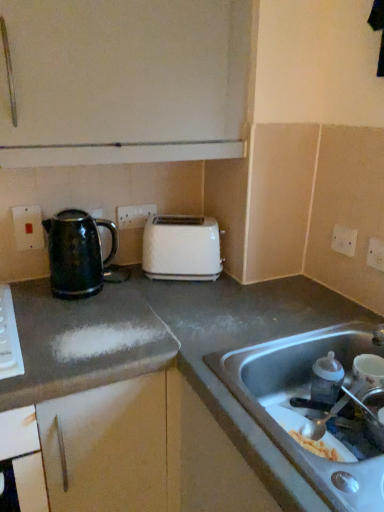
Measure the distance between white plastic electric outlet at upper right, which appears as the 3th electric outlet when viewed from the left, and camera.

The depth of white plastic electric outlet at upper right, which appears as the 3th electric outlet when viewed from the left, is 4.10 feet.

How much space does white plastic electric outlet at upper right, marked as the 2th electric outlet in a right-to-left arrangement, occupy horizontally?

white plastic electric outlet at upper right, marked as the 2th electric outlet in a right-to-left arrangement, is 0.70 inches wide.

Identify the location of white plastic electric outlet at center, marked as the first electric outlet in a back-to-front arrangement. (134, 215).

Image resolution: width=384 pixels, height=512 pixels. What do you see at coordinates (28, 228) in the screenshot?
I see `matte plastic electric outlet at upper left, placed as the 4th electric outlet when sorted from right to left` at bounding box center [28, 228].

What do you see at coordinates (376, 254) in the screenshot? This screenshot has height=512, width=384. I see `white plastic electric outlet at upper right, marked as the first electric outlet in a front-to-back arrangement` at bounding box center [376, 254].

Locate an element on the screen. The width and height of the screenshot is (384, 512). white plastic electric outlet at upper right, acting as the third electric outlet starting from the back is located at coordinates (344, 240).

Is metallic silver faucet at sink right placed right next to shiny metallic kettle at center-left, which is the second countertop in right-to-left order?

No, metallic silver faucet at sink right is not touching shiny metallic kettle at center-left, which is the second countertop in right-to-left order.

Locate an element on the screen. The height and width of the screenshot is (512, 384). countertop that is the 2nd object to the left of the metallic silver faucet at sink right, starting at the anchor is located at coordinates (83, 341).

Consider the image. Considering the relative positions of metallic silver faucet at sink right and shiny metallic kettle at center-left, which is the second countertop in right-to-left order, in the image provided, is metallic silver faucet at sink right to the right of shiny metallic kettle at center-left, which is the second countertop in right-to-left order, from the viewer's perspective?

Yes, metallic silver faucet at sink right is to the right of shiny metallic kettle at center-left, which is the second countertop in right-to-left order.

Is there a large distance between shiny metallic kettle at left and white plastic electric outlet at upper right, acting as the third electric outlet starting from the back?

They are positioned close to each other.

Consider the image. Does shiny metallic kettle at left have a lesser height compared to white plastic electric outlet at upper right, acting as the third electric outlet starting from the back?

In fact, shiny metallic kettle at left may be taller than white plastic electric outlet at upper right, acting as the third electric outlet starting from the back.

Between shiny metallic kettle at left and white plastic electric outlet at upper right, marked as the 2th electric outlet in a right-to-left arrangement, which one appears on the left side from the viewer's perspective?

shiny metallic kettle at left.

From the image's perspective, relative to white plastic toaster at center, is white plastic electric outlet at upper right, which is the second electric outlet in front-to-back order, above or below?

Clearly, from the image's perspective, white plastic electric outlet at upper right, which is the second electric outlet in front-to-back order, is above white plastic toaster at center.

Can you confirm if white plastic electric outlet at upper right, which is the second electric outlet in front-to-back order, is positioned to the right of white plastic toaster at center?

Yes.

What's the angular difference between white plastic electric outlet at upper right, acting as the third electric outlet starting from the back, and white plastic toaster at center's facing directions?

60.6 degrees.

Starting from the white plastic toaster at center, which electric outlet is the 2nd one in front? Please provide its 2D coordinates.

[(344, 240)]

How many degrees apart are the facing directions of white plastic toaster at center and stainless steel sink at lower right?

The angular difference between white plastic toaster at center and stainless steel sink at lower right is 61.6 degrees.

Is white plastic toaster at center oriented towards stainless steel sink at lower right?

No.

Is white plastic toaster at center in front of or behind stainless steel sink at lower right in the image?

Visually, white plastic toaster at center is located behind stainless steel sink at lower right.

Which of these two, white plastic toaster at center or stainless steel sink at lower right, is bigger?

stainless steel sink at lower right.

From the picture: Is shiny metallic kettle at left situated inside stainless steel sink at lower right or outside?

shiny metallic kettle at left is outside stainless steel sink at lower right.

Is shiny metallic kettle at left smaller than stainless steel sink at lower right?

Yes.

From a real-world perspective, between shiny metallic kettle at left and stainless steel sink at lower right, who is vertically lower?

stainless steel sink at lower right is physically lower.

Is white plastic electric outlet at center, placed as the second electric outlet when sorted from left to right, a part of shiny metallic kettle at center-left, which is the second countertop in right-to-left order?

Actually, white plastic electric outlet at center, placed as the second electric outlet when sorted from left to right, is outside shiny metallic kettle at center-left, which is the second countertop in right-to-left order.

Considering the relative sizes of shiny metallic kettle at center-left, which is the second countertop in right-to-left order, and white plastic electric outlet at center, the fourth electric outlet from the front, in the image provided, is shiny metallic kettle at center-left, which is the second countertop in right-to-left order, shorter than white plastic electric outlet at center, the fourth electric outlet from the front,?

No, shiny metallic kettle at center-left, which is the second countertop in right-to-left order, is not shorter than white plastic electric outlet at center, the fourth electric outlet from the front.

Is white plastic electric outlet at center, the fourth electric outlet from the front, at the back of shiny metallic kettle at center-left, which is the second countertop in right-to-left order?

No, white plastic electric outlet at center, the fourth electric outlet from the front, is not at the back of shiny metallic kettle at center-left, which is the second countertop in right-to-left order.

Which is more to the left, shiny metallic kettle at center-left, which is the second countertop in right-to-left order, or white plastic electric outlet at center, marked as the first electric outlet in a back-to-front arrangement?

Positioned to the left is shiny metallic kettle at center-left, which is the second countertop in right-to-left order.

Image resolution: width=384 pixels, height=512 pixels. In order to click on sink located below the matte plastic electric outlet at upper left, which is counted as the second electric outlet, starting from the back (from the image's perspective) in this screenshot , I will do `click(304, 396)`.

From the image's perspective, who appears lower, stainless steel sink at lower right or matte plastic electric outlet at upper left, which is counted as the first electric outlet, starting from the left?

stainless steel sink at lower right appears lower in the image.

Does stainless steel sink at lower right contain matte plastic electric outlet at upper left, placed as the 4th electric outlet when sorted from right to left?

That's incorrect, matte plastic electric outlet at upper left, placed as the 4th electric outlet when sorted from right to left, is not inside stainless steel sink at lower right.

From a real-world perspective, count 1st countertops downward from the metallic silver faucet at sink right and point to it. Please provide its 2D coordinates.

[(83, 341)]

In order to click on kitchen appliance on the left of white plastic electric outlet at upper right, which appears as the 3th electric outlet when viewed from the left in this screenshot , I will do (77, 253).

Which object lies nearer to the anchor point shiny metallic kettle at left, white plastic electric outlet at upper right, the first electric outlet when ordered from right to left, or metallic silver faucet at sink right?

Based on the image, metallic silver faucet at sink right appears to be nearer to shiny metallic kettle at left.

Considering their positions, is white plastic electric outlet at center, placed as the second electric outlet when sorted from left to right, positioned further to white plastic toaster at center than shiny metallic kettle at center-left, placed as the 1th countertop when sorted from left to right?

The object further to white plastic toaster at center is shiny metallic kettle at center-left, placed as the 1th countertop when sorted from left to right.

From the image, which object appears to be nearer to white plastic electric outlet at center, placed as the second electric outlet when sorted from left to right, white plastic electric outlet at upper right, marked as the 2th electric outlet in a right-to-left arrangement, or metallic silver faucet at sink right?

white plastic electric outlet at upper right, marked as the 2th electric outlet in a right-to-left arrangement, lies closer to white plastic electric outlet at center, placed as the second electric outlet when sorted from left to right, than the other object.

Which object lies nearer to the anchor point gray matte countertop at center, which appears as the 1th countertop when viewed from the right, shiny metallic kettle at left or metallic silver faucet at sink right?

Based on the image, shiny metallic kettle at left appears to be nearer to gray matte countertop at center, which appears as the 1th countertop when viewed from the right.

Based on their spatial positions, is shiny metallic kettle at center-left, placed as the 1th countertop when sorted from left to right, or white plastic electric outlet at upper right, the fourth electric outlet from the left, further from stainless steel sink at lower right?

white plastic electric outlet at upper right, the fourth electric outlet from the left.

From the image, which object appears to be farther from shiny metallic kettle at center-left, placed as the 1th countertop when sorted from left to right, white plastic electric outlet at upper right, the first electric outlet when ordered from right to left, or matte plastic electric outlet at upper left, which is counted as the first electric outlet, starting from the left?

The object further to shiny metallic kettle at center-left, placed as the 1th countertop when sorted from left to right, is white plastic electric outlet at upper right, the first electric outlet when ordered from right to left.

Estimate the real-world distances between objects in this image. Which object is closer to white plastic electric outlet at center, marked as the 3th electric outlet in a right-to-left arrangement, gray matte countertop at center, which appears as the 1th countertop when viewed from the right, or white plastic electric outlet at upper right, the first electric outlet when ordered from right to left?

Among the two, gray matte countertop at center, which appears as the 1th countertop when viewed from the right, is located nearer to white plastic electric outlet at center, marked as the 3th electric outlet in a right-to-left arrangement.

Estimate the real-world distances between objects in this image. Which object is closer to white plastic electric outlet at center, marked as the first electric outlet in a back-to-front arrangement, shiny metallic kettle at left or metallic silver faucet at sink right?

Based on the image, shiny metallic kettle at left appears to be nearer to white plastic electric outlet at center, marked as the first electric outlet in a back-to-front arrangement.

Image resolution: width=384 pixels, height=512 pixels. Identify the location of toaster situated between shiny metallic kettle at left and stainless steel sink at lower right from left to right. click(x=181, y=248).

Where is `kitchen appliance between matte plastic electric outlet at upper left, which is counted as the second electric outlet, starting from the back, and white plastic electric outlet at center, placed as the second electric outlet when sorted from left to right`? Image resolution: width=384 pixels, height=512 pixels. kitchen appliance between matte plastic electric outlet at upper left, which is counted as the second electric outlet, starting from the back, and white plastic electric outlet at center, placed as the second electric outlet when sorted from left to right is located at coordinates (77, 253).

Identify the location of toaster situated between shiny metallic kettle at center-left, which is the second countertop in right-to-left order, and metallic silver faucet at sink right from left to right. coord(181,248).

At what (x,y) coordinates should I click in order to perform the action: click on countertop located between shiny metallic kettle at center-left, placed as the 1th countertop when sorted from left to right, and stainless steel sink at lower right in the left-right direction. Please return your answer as a coordinate pair (x, y). Image resolution: width=384 pixels, height=512 pixels. Looking at the image, I should click on (174, 348).